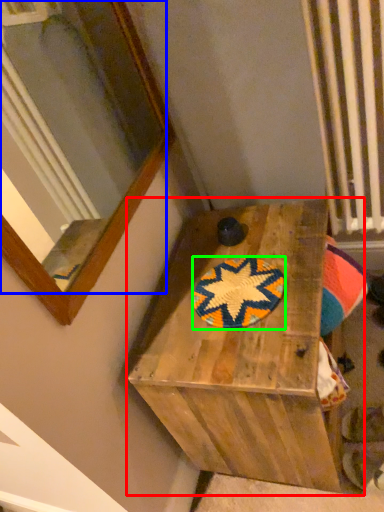
Question: Which object is positioned farthest from furniture (highlighted by a red box)? Select from mirror (highlighted by a blue box) and mat (highlighted by a green box).

Choices:
 (A) mirror
 (B) mat

Answer: (A)